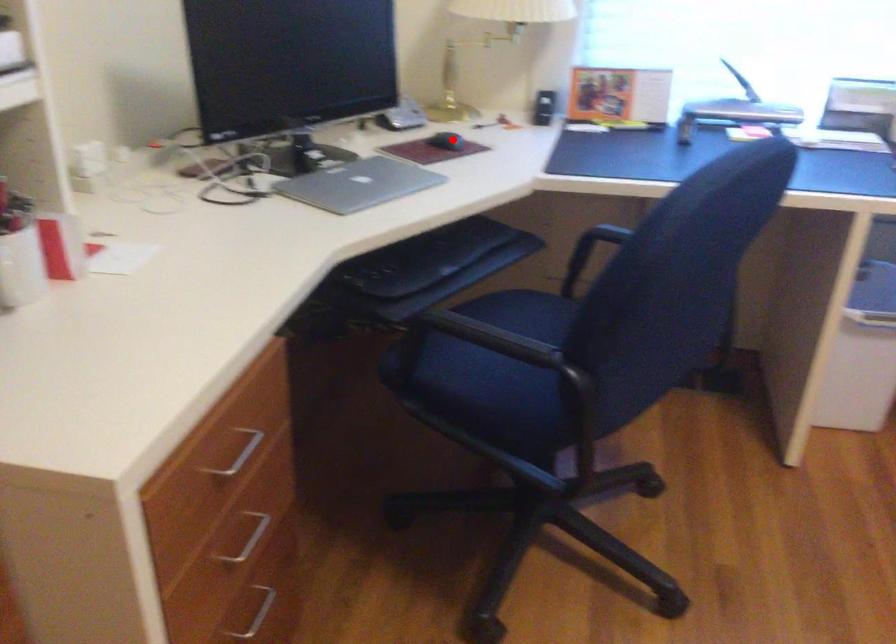
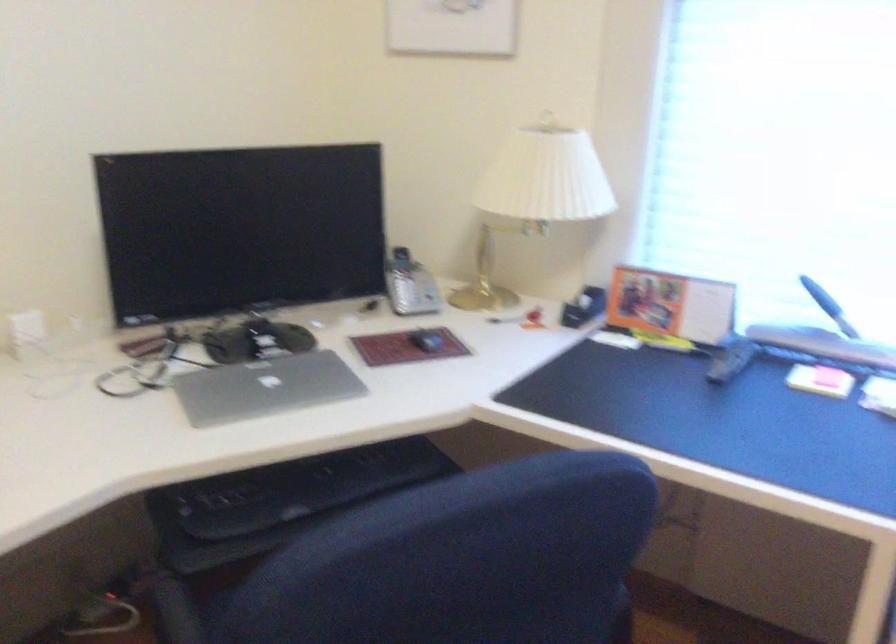
Where in the second image is the point corresponding to the highlighted location from the first image?

(426, 341)